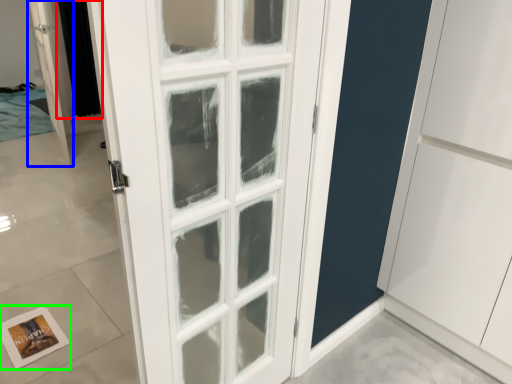
Question: Which object is positioned closest to curtain (highlighted by a red box)? Select from door (highlighted by a blue box) and postcard (highlighted by a green box).

Choices:
 (A) door
 (B) postcard

Answer: (A)